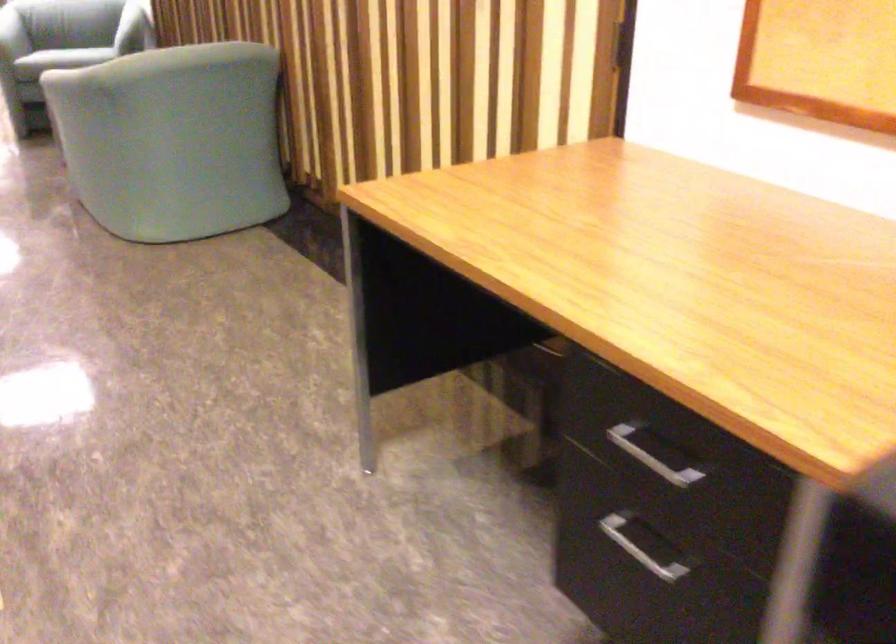
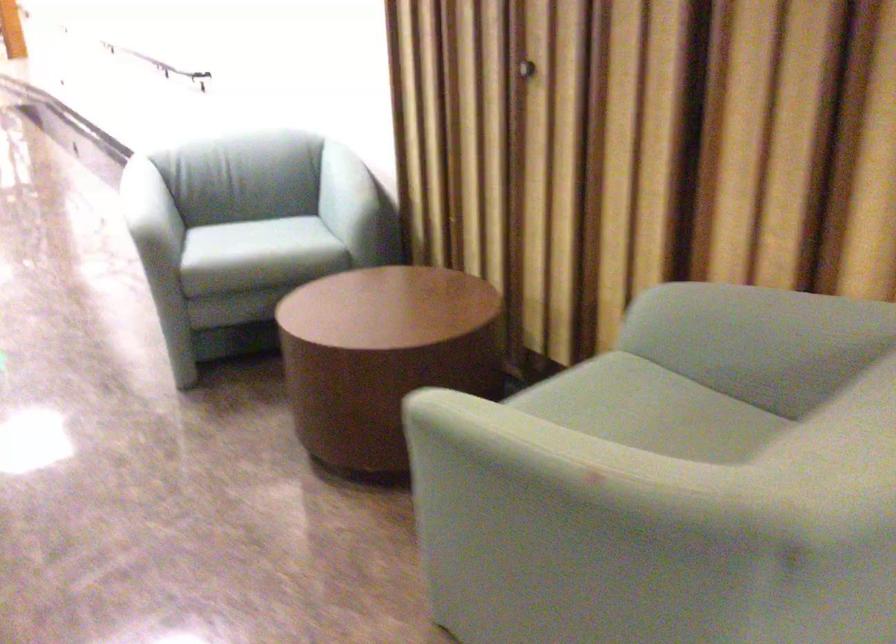
In a continuous first-person perspective shot, in which direction is the camera moving?

The cameraman moved toward left, forward.